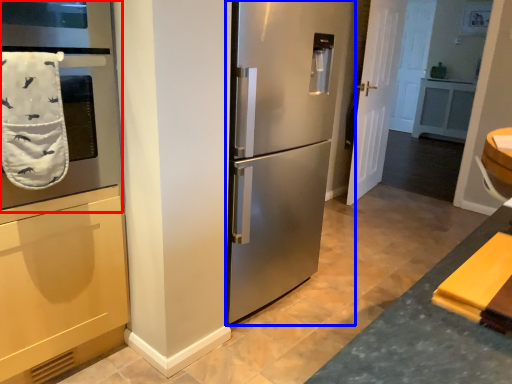
Question: Among these objects, which one is nearest to the camera, oven (highlighted by a red box) or refrigerator (highlighted by a blue box)?

Choices:
 (A) oven
 (B) refrigerator

Answer: (A)